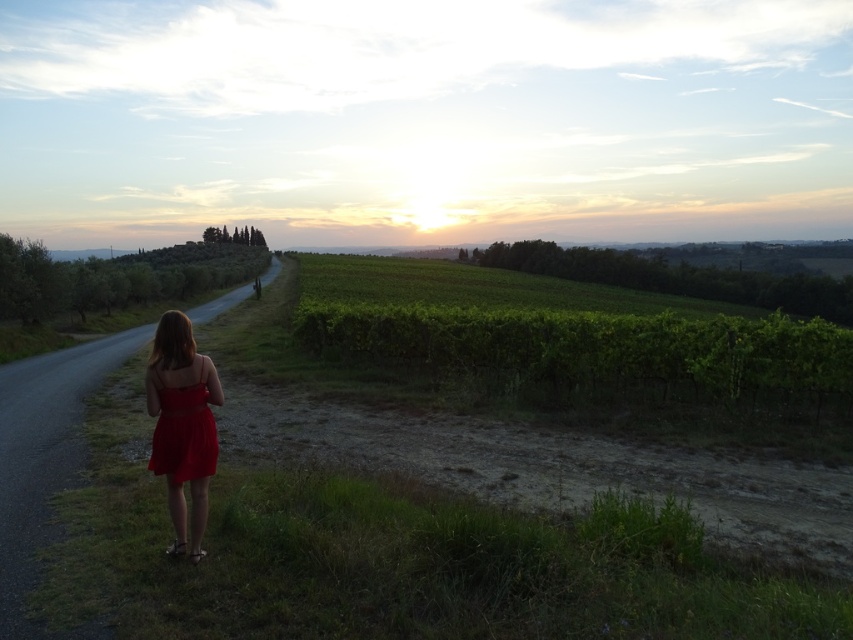
Measure the distance between matte red dress at left and matte red dress at back.

matte red dress at left is 4.71 inches away from matte red dress at back.

Is matte red dress at left positioned behind matte red dress at back?

No, matte red dress at left is in front of matte red dress at back.

At what (x,y) coordinates should I click in order to perform the action: click on matte red dress at left. Please return your answer as a coordinate pair (x, y). The height and width of the screenshot is (640, 853). Looking at the image, I should click on (183, 426).

Find the location of a particular element. The image size is (853, 640). matte red dress at left is located at coordinates (183, 426).

Does green leafy vineyard at center have a larger size compared to matte red dress at back?

Correct, green leafy vineyard at center is larger in size than matte red dress at back.

Who is shorter, green leafy vineyard at center or matte red dress at back?

With less height is matte red dress at back.

The width and height of the screenshot is (853, 640). What do you see at coordinates (569, 339) in the screenshot?
I see `green leafy vineyard at center` at bounding box center [569, 339].

This screenshot has width=853, height=640. I want to click on green leafy vineyard at center, so click(x=569, y=339).

Can you confirm if green leafy vineyard at center is smaller than matte red dress at left?

Incorrect, green leafy vineyard at center is not smaller in size than matte red dress at left.

Does green leafy vineyard at center lie in front of matte red dress at left?

No, green leafy vineyard at center is behind matte red dress at left.

Between point (602, 372) and point (166, 358), which one is positioned behind?

Point (602, 372)

The width and height of the screenshot is (853, 640). Find the location of `green leafy vineyard at center`. green leafy vineyard at center is located at coordinates (569, 339).